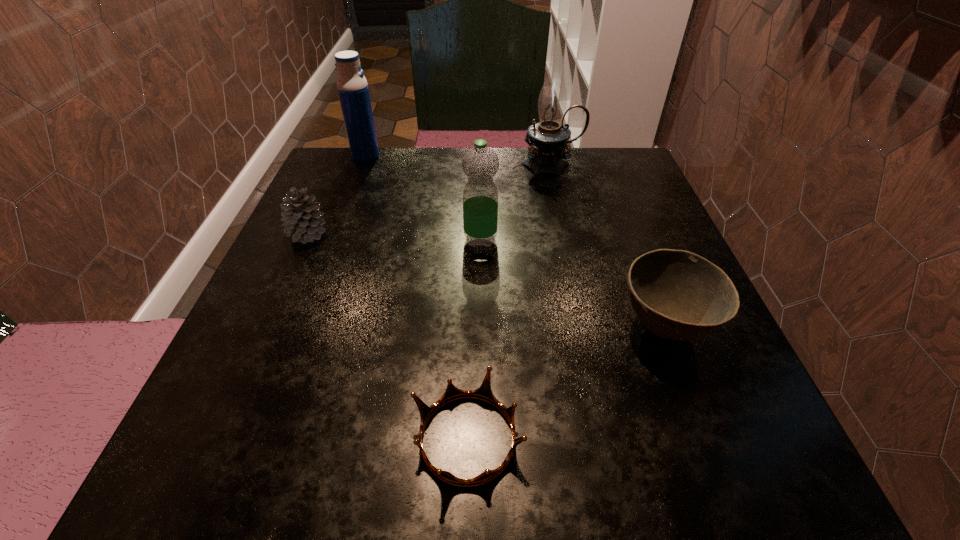
Where is `object that stands as the third closest to the bowl`? object that stands as the third closest to the bowl is located at coordinates (548, 139).

What are the coordinates of `object that stands as the fifth closest to the nearer water bottle` in the screenshot? It's located at (352, 86).

Find the location of a particular element. blank space that satisfies the following two spatial constraints: 1. on the back side of the pinecone; 2. on the left side of the farther water bottle is located at coordinates (343, 156).

Identify the location of blank area in the image that satisfies the following two spatial constraints: 1. on the back side of the shortest object; 2. on the left side of the second nearest object. The height and width of the screenshot is (540, 960). (469, 328).

Image resolution: width=960 pixels, height=540 pixels. I want to click on vacant area in the image that satisfies the following two spatial constraints: 1. on the back side of the shorter water bottle; 2. on the left side of the crown, so click(x=471, y=239).